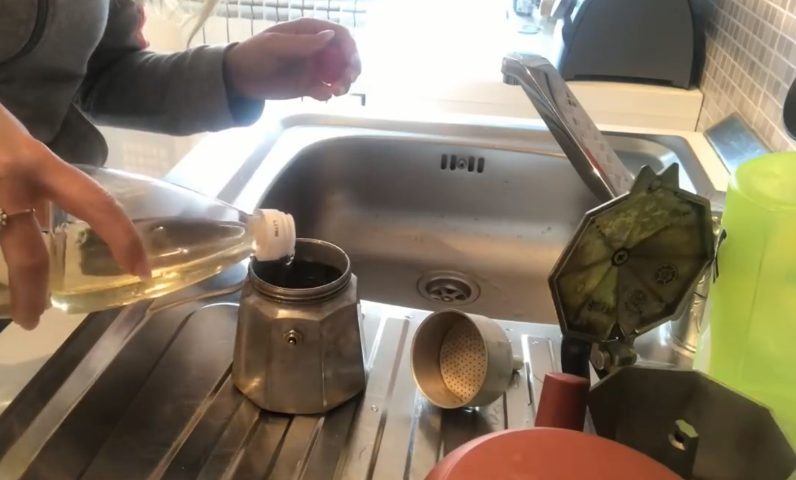
Identify the location of coffee maker. The width and height of the screenshot is (796, 480). (618, 275), (674, 400).